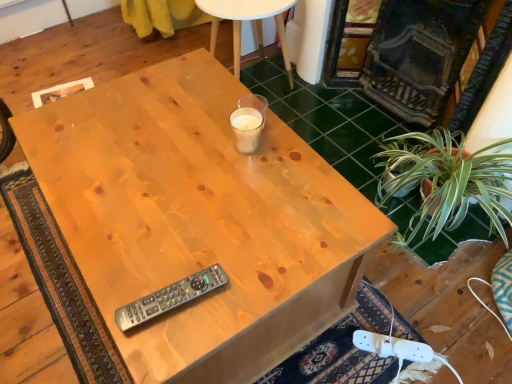
I want to click on vacant area in front of gray plastic remote at center, so click(x=164, y=344).